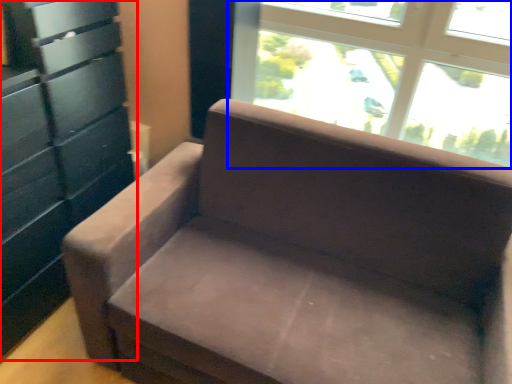
Question: Which point is closer to the camera, dresser (highlighted by a red box) or window (highlighted by a blue box)?

Choices:
 (A) dresser
 (B) window

Answer: (A)